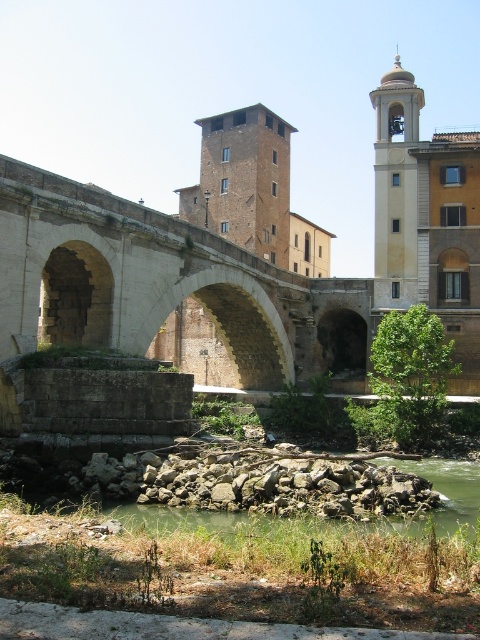
Question: Is stone arch bridge at center thinner than brown brick tower at center?

Choices:
 (A) yes
 (B) no

Answer: (B)

Question: Among these points, which one is farthest from the camera?

Choices:
 (A) (132, 232)
 (B) (392, 80)
 (C) (256, 237)

Answer: (C)

Question: Which point is closer to the camera?

Choices:
 (A) brown brick tower at center
 (B) stone arch bridge at center

Answer: (B)

Question: Does stone arch bridge at center have a greater width compared to light beige stone bell tower at upper right?

Choices:
 (A) yes
 (B) no

Answer: (A)

Question: Is brown brick tower at center positioned at the back of light beige stone bell tower at upper right?

Choices:
 (A) no
 (B) yes

Answer: (B)

Question: Which is farther from the stone arch bridge at center?

Choices:
 (A) light beige stone bell tower at upper right
 (B) brown brick tower at center

Answer: (B)